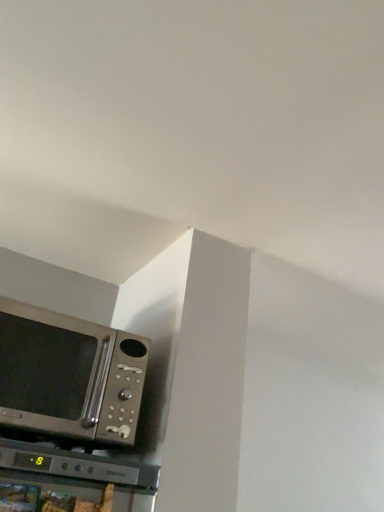
What is the approximate height of metallic silver microwave at lower left?

It is 12.11 inches.

Find the location of a particular element. metallic silver microwave at lower left is located at coordinates (69, 375).

Describe the element at coordinates (69, 375) in the screenshot. The width and height of the screenshot is (384, 512). I see `metallic silver microwave at lower left` at that location.

In order to click on metallic silver microwave at lower left in this screenshot , I will do `click(69, 375)`.